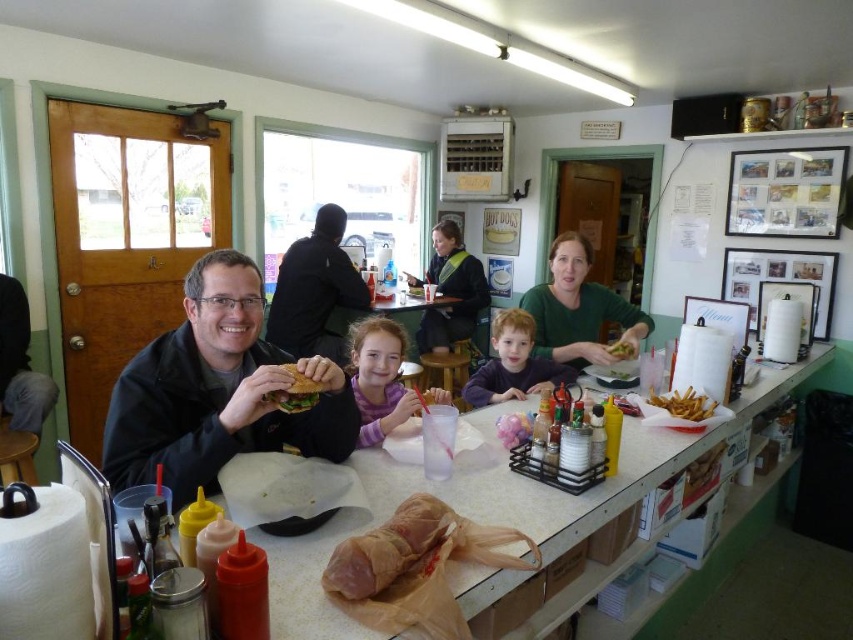
Consider the image. Who is positioned more to the left, translucent plastic bag at center or matte brown sandwich at center?

matte brown sandwich at center is more to the left.

Is translucent plastic bag at center to the right of matte brown sandwich at center from the viewer's perspective?

Correct, you'll find translucent plastic bag at center to the right of matte brown sandwich at center.

Where is `translucent plastic bag at center`? translucent plastic bag at center is located at coordinates (514, 428).

Identify the location of translucent plastic bag at center. (514, 428).

Does point (759, 372) come behind point (440, 225)?

That is False.

Can you confirm if white plastic table at center is smaller than green fabric vest at center?

No, white plastic table at center is not smaller than green fabric vest at center.

You are a GUI agent. You are given a task and a screenshot of the screen. Output one action in this format:
    pyautogui.click(x=<x>, y=<y>)
    Task: Click on the white plastic table at center
    This screenshot has width=853, height=640.
    Given the screenshot: What is the action you would take?
    [496, 504]

This screenshot has height=640, width=853. In order to click on white plastic table at center in this screenshot , I will do `click(496, 504)`.

Who is positioned more to the left, black matte jacket at center or matte green sandwich at center?

black matte jacket at center is more to the left.

Locate an element on the screen. This screenshot has height=640, width=853. black matte jacket at center is located at coordinates (315, 291).

Is point (311, 348) positioned before point (616, 346)?

No.

Find the location of a particular element. black matte jacket at center is located at coordinates (315, 291).